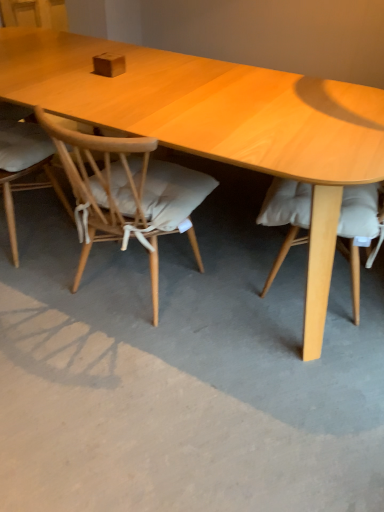
Question: Is the position of gray concrete at center less distant than that of light wood chair at center, the 1th chair viewed from the right?

Choices:
 (A) no
 (B) yes

Answer: (B)

Question: Does gray concrete at center appear on the right side of light wood chair at center, the second chair viewed from the left?

Choices:
 (A) no
 (B) yes

Answer: (B)

Question: From the image's perspective, is gray concrete at center under light wood chair at center, the second chair viewed from the left?

Choices:
 (A) yes
 (B) no

Answer: (A)

Question: Is gray concrete at center further to camera compared to light wood chair at center, the 1th chair viewed from the right?

Choices:
 (A) no
 (B) yes

Answer: (A)

Question: Can you confirm if gray concrete at center is wider than light wood chair at center, the second chair viewed from the left?

Choices:
 (A) no
 (B) yes

Answer: (B)

Question: Is light wood chair at center, the second chair viewed from the left, taller or shorter than gray concrete at center?

Choices:
 (A) short
 (B) tall

Answer: (B)

Question: Looking at their shapes, would you say light wood chair at center, the second chair viewed from the left, is wider or thinner than gray concrete at center?

Choices:
 (A) thin
 (B) wide

Answer: (A)

Question: Considering the positions of light wood chair at center, the 1th chair viewed from the right, and gray concrete at center in the image, is light wood chair at center, the 1th chair viewed from the right, bigger or smaller than gray concrete at center?

Choices:
 (A) small
 (B) big

Answer: (B)

Question: From a real-world perspective, is light wood chair at center, the 1th chair viewed from the right, physically located above or below gray concrete at center?

Choices:
 (A) above
 (B) below

Answer: (A)

Question: Considering the positions of light brown wood chair at left, the first chair viewed from the left, and light wood chair at center, the 1th chair viewed from the right, in the image, is light brown wood chair at left, the first chair viewed from the left, taller or shorter than light wood chair at center, the 1th chair viewed from the right,?

Choices:
 (A) short
 (B) tall

Answer: (B)

Question: Is light brown wood chair at left, which is the second chair in right-to-left order, to the left or to the right of light wood chair at center, the 1th chair viewed from the right, in the image?

Choices:
 (A) left
 (B) right

Answer: (A)

Question: Is point (49, 151) closer or farther from the camera than point (148, 231)?

Choices:
 (A) farther
 (B) closer

Answer: (A)

Question: Is light brown wood chair at left, which is the second chair in right-to-left order, wider or thinner than light wood chair at center, the 1th chair viewed from the right?

Choices:
 (A) wide
 (B) thin

Answer: (B)

Question: Is gray concrete at center inside the boundaries of light brown wood chair at left, which is the second chair in right-to-left order, or outside?

Choices:
 (A) outside
 (B) inside

Answer: (A)

Question: In terms of size, does gray concrete at center appear bigger or smaller than light brown wood chair at left, the first chair viewed from the left?

Choices:
 (A) small
 (B) big

Answer: (A)